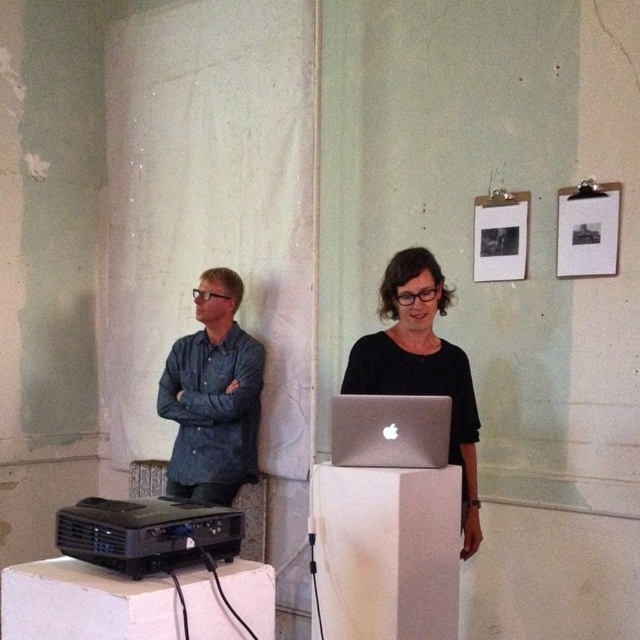
Question: Estimate the real-world distances between objects in this image. Which object is closer to the white fabric speaker at center?

Choices:
 (A) black matte laptop at center
 (B) silver metallic laptop at center
 (C) denim shirt at left

Answer: (B)

Question: Which of the following is the farthest from the observer?

Choices:
 (A) black matte laptop at center
 (B) denim shirt at left
 (C) silver metallic laptop at center
 (D) white fabric speaker at center

Answer: (B)

Question: Does white fabric speaker at center appear on the left side of silver metallic laptop at center?

Choices:
 (A) no
 (B) yes

Answer: (B)

Question: Considering the relative positions of white fabric speaker at center and denim shirt at left in the image provided, where is white fabric speaker at center located with respect to denim shirt at left?

Choices:
 (A) left
 (B) right

Answer: (B)

Question: Estimate the real-world distances between objects in this image. Which object is closer to the silver metallic laptop at center?

Choices:
 (A) denim shirt at left
 (B) black matte laptop at center

Answer: (B)

Question: Can you confirm if white fabric speaker at center is smaller than silver metallic laptop at center?

Choices:
 (A) no
 (B) yes

Answer: (A)